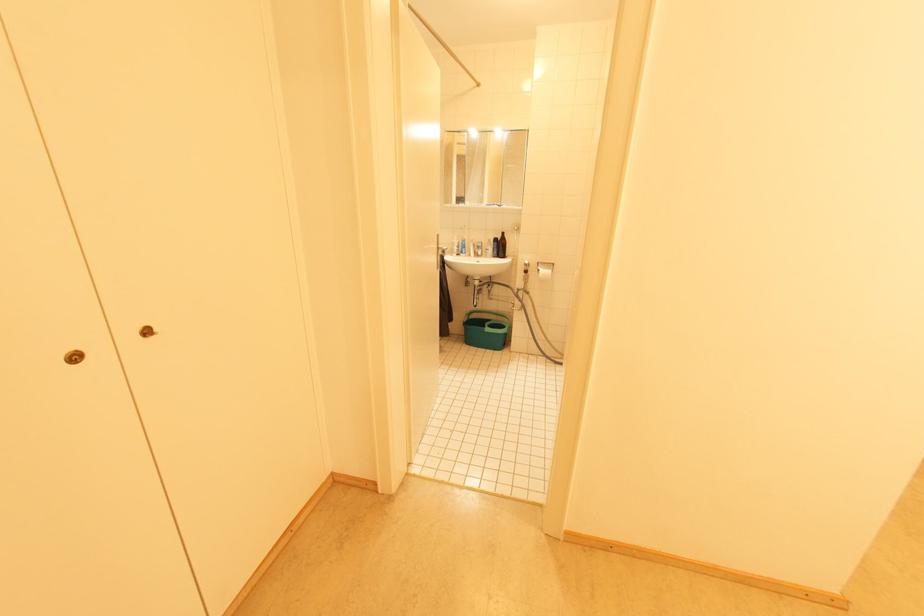
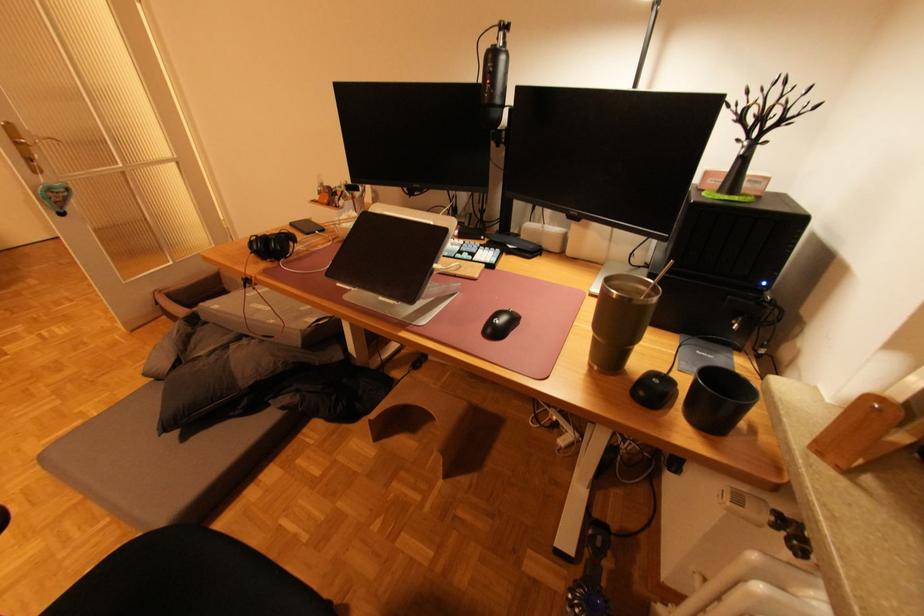
In a continuous first-person perspective shot, in which direction is the camera moving?

The cameraman moved toward right, backward.